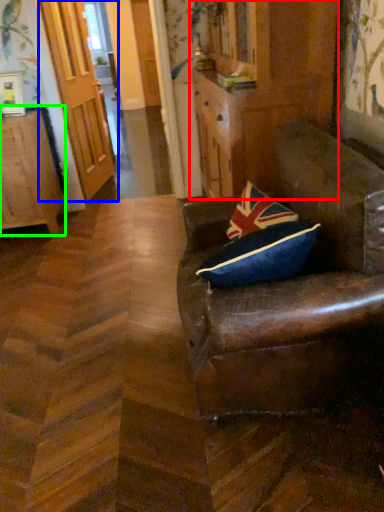
Question: Considering the real-world distances, which object is farthest from dresser (highlighted by a red box)? door (highlighted by a blue box) or cabinetry (highlighted by a green box)?

Choices:
 (A) door
 (B) cabinetry

Answer: (A)